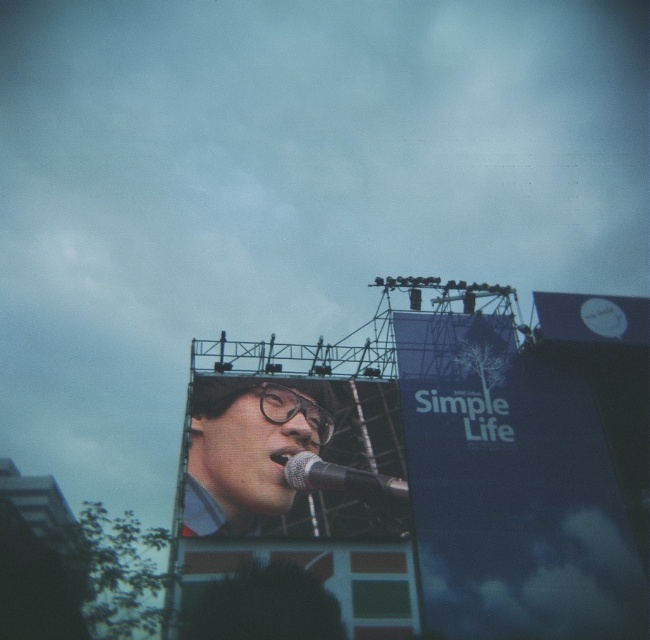
You are a photographer at the event and need to adjust your camera settings to capture both the blue matte signboard at upper right and the green fabric banner at lower center in the same frame. Which object should you focus on first if you want to ensure both are in focus, considering their relative positions?

The blue matte signboard at upper right has a greater height compared to the green fabric banner at lower center. To ensure both are in focus, focus on the blue matte signboard at upper right first since it is taller and likely farther away, allowing the depth of field to cover the closer green fabric banner at lower center.

You are a stagehand who needs to adjust the distance between the two microphones. The venue requires that the distance between the matte black microphone at center and the silver metallic microphone at center must be exactly 15 feet. Currently, they are 14.18 feet apart. How much more space do you need to add between them to meet the requirement?

The current distance between the matte black microphone at center and the silver metallic microphone at center is 14.18 feet. To reach the required 15 feet, you need to add 0.82 feet of space between them.